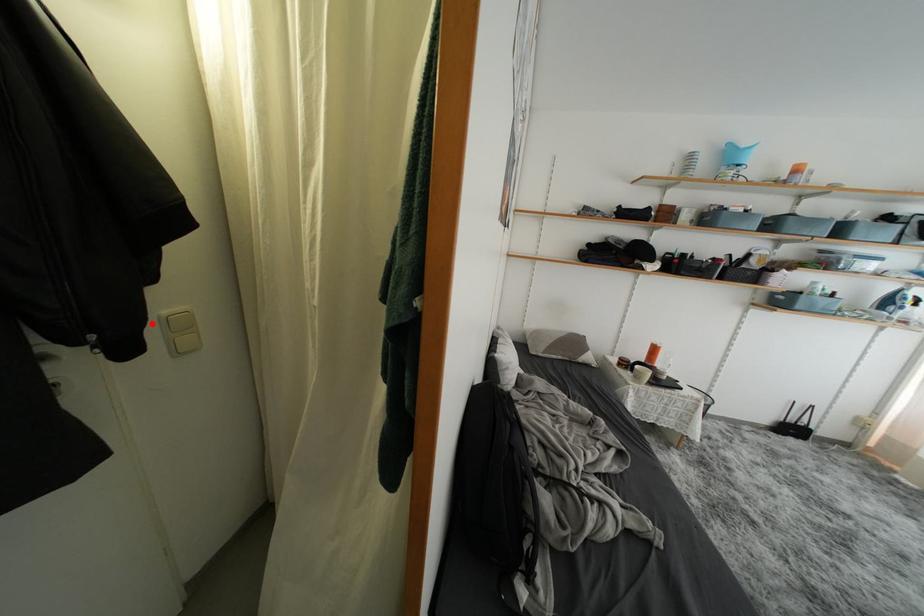
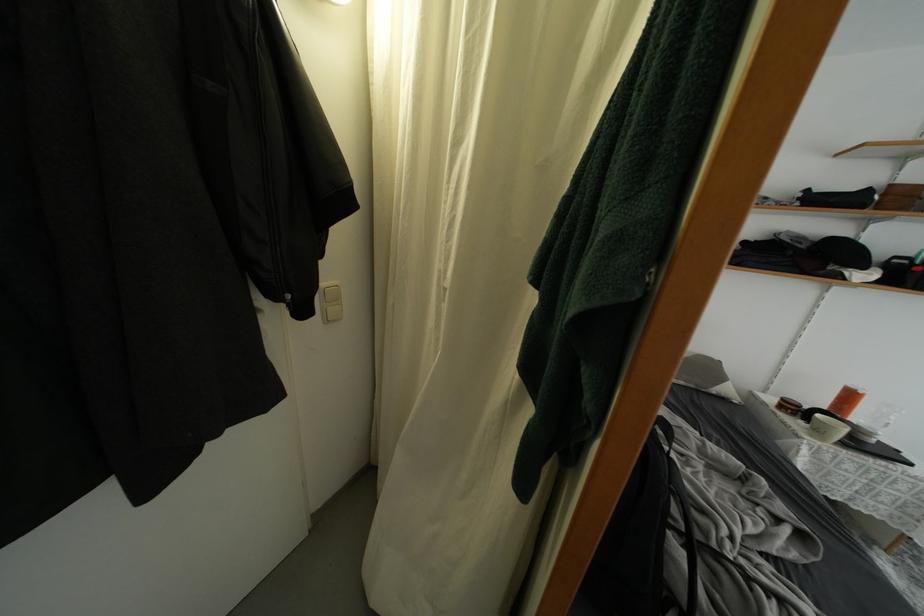
Where in the second image is the point corresponding to the highlighted location from the first image?

(323, 291)